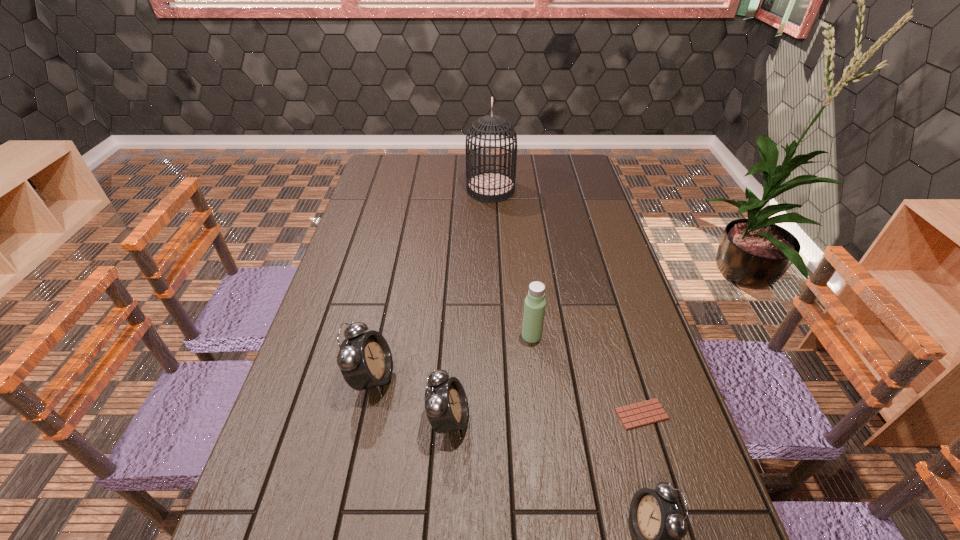
Identify the location of vacant space that's between the farthest object and the second alarm clock from right to left. The image size is (960, 540). pyautogui.click(x=469, y=305).

Image resolution: width=960 pixels, height=540 pixels. What are the coordinates of `empty location between the candy bar and the leftmost alarm clock` in the screenshot? It's located at (507, 396).

Find the location of a particular element. Image resolution: width=960 pixels, height=540 pixels. free spot between the second farthest object and the shortest object is located at coordinates (587, 375).

Where is `free space that is in between the candy bar and the thermos bottle`? free space that is in between the candy bar and the thermos bottle is located at coordinates (587, 375).

What are the coordinates of `empty location between the tallest object and the leftmost alarm clock` in the screenshot? It's located at (431, 284).

Find the location of `empty space between the leftmost object and the farthest object`. empty space between the leftmost object and the farthest object is located at coordinates (431, 284).

Locate an element on the screen. The width and height of the screenshot is (960, 540). free space between the second tallest alarm clock and the farthest object is located at coordinates (469, 305).

Select which object is the fifth closest to the rightmost alarm clock. Please provide its 2D coordinates. Your answer should be formatted as a tuple, i.e. [(x, y)], where the tuple contains the x and y coordinates of a point satisfying the conditions above.

[(489, 186)]

Select which object appears as the fifth closest to the birdcage. Please provide its 2D coordinates. Your answer should be formatted as a tuple, i.e. [(x, y)], where the tuple contains the x and y coordinates of a point satisfying the conditions above.

[(656, 517)]

Locate which alarm clock ranks second in proximity to the second tallest alarm clock. Please provide its 2D coordinates. Your answer should be formatted as a tuple, i.e. [(x, y)], where the tuple contains the x and y coordinates of a point satisfying the conditions above.

[(656, 517)]